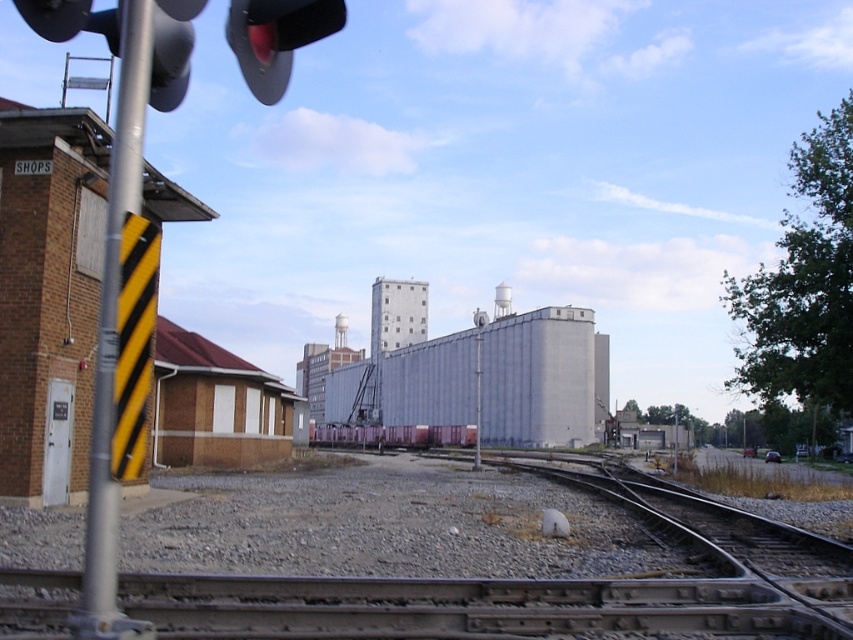
Question: Which object is the farthest from the smooth metal train track at center?

Choices:
 (A) smooth steel tracks at center
 (B) black matte traffic light at upper center
 (C) metal/yellow/black sign at left
 (D) metallic pink train car at center

Answer: (D)

Question: Which object is closer to the camera taking this photo?

Choices:
 (A) smooth steel tracks at center
 (B) metallic pink train car at center
 (C) metal/yellow/black sign at left
 (D) smooth metal train track at center

Answer: (C)

Question: Observing the image, what is the correct spatial positioning of metal/yellow/black sign at left in reference to black matte traffic light at upper center?

Choices:
 (A) right
 (B) left

Answer: (B)

Question: Which point appears closest to the camera in this image?

Choices:
 (A) (260, 36)
 (B) (103, 433)
 (C) (466, 433)
 (D) (253, 624)

Answer: (B)

Question: Is smooth steel tracks at center below black matte traffic light at upper center?

Choices:
 (A) yes
 (B) no

Answer: (A)

Question: Is metal/yellow/black sign at left wider than metallic pink train car at center?

Choices:
 (A) yes
 (B) no

Answer: (B)